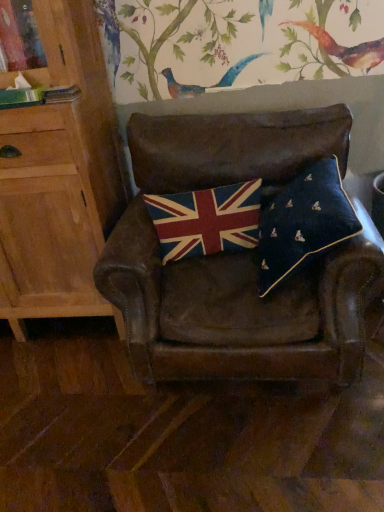
Describe the element at coordinates (237, 258) in the screenshot. The width and height of the screenshot is (384, 512). I see `leather chair at center` at that location.

This screenshot has width=384, height=512. What do you see at coordinates (206, 220) in the screenshot?
I see `textured woolen flag at center` at bounding box center [206, 220].

The width and height of the screenshot is (384, 512). What are the coordinates of `leather chair at center` in the screenshot? It's located at point(237,258).

Is point (252, 266) closer to camera compared to point (334, 217)?

No.

From a real-world perspective, between leather chair at center and navy velvet pillow at center, who is vertically higher?

navy velvet pillow at center, from a real-world perspective.

From the image's perspective, between leather chair at center and navy velvet pillow at center, which one is located above?

leather chair at center, from the image's perspective.

Identify the location of chair that appears on the left of navy velvet pillow at center. (237, 258).

Between navy velvet pillow at center and leather chair at center, which one has larger width?

Wider between the two is leather chair at center.

Does navy velvet pillow at center lie behind leather chair at center?

Yes, navy velvet pillow at center is behind leather chair at center.

From a real-world perspective, is navy velvet pillow at center physically located above or below leather chair at center?

navy velvet pillow at center is above leather chair at center.

The image size is (384, 512). I want to click on chair lying above the navy velvet pillow at center (from the image's perspective), so coord(237,258).

Can you confirm if textured woolen flag at center is positioned to the left of leather chair at center?

Correct, you'll find textured woolen flag at center to the left of leather chair at center.

Considering the positions of point (162, 226) and point (281, 300), is point (162, 226) closer or farther from the camera than point (281, 300)?

Point (162, 226) is farther from the camera than point (281, 300).

From the image's perspective, relative to leather chair at center, is textured woolen flag at center above or below?

textured woolen flag at center is above leather chair at center.

Choose the correct answer: Is textured woolen flag at center inside leather chair at center or outside it?

The correct answer is: inside.

From their relative heights in the image, would you say light wood cabinet at left is taller or shorter than textured woolen flag at center?

Considering their sizes, light wood cabinet at left has more height than textured woolen flag at center.

Is light wood cabinet at left closer to the viewer compared to textured woolen flag at center?

Yes, light wood cabinet at left is closer to the viewer.

Between light wood cabinet at left and textured woolen flag at center, which one appears on the right side from the viewer's perspective?

Positioned to the right is textured woolen flag at center.

How distant is light wood cabinet at left from textured woolen flag at center?

17.85 inches.

Identify the location of cabinetry to the left of leather chair at center. (60, 178).

From a real-world perspective, which is physically above, light wood cabinet at left or leather chair at center?

light wood cabinet at left is physically above.

Consider the image. Is leather chair at center completely or partially inside light wood cabinet at left?

That's incorrect, leather chair at center is not inside light wood cabinet at left.

From the image's perspective, is light wood cabinet at left positioned above or below leather chair at center?

light wood cabinet at left is situated higher than leather chair at center in the image.

From a real-world perspective, between light wood cabinet at left and navy velvet pillow at center, who is vertically lower?

navy velvet pillow at center is physically lower.

Is light wood cabinet at left directly adjacent to navy velvet pillow at center?

They are not placed beside each other.

Measure the distance from light wood cabinet at left to navy velvet pillow at center.

light wood cabinet at left is 31.27 inches away from navy velvet pillow at center.

Considering the relative sizes of light wood cabinet at left and navy velvet pillow at center in the image provided, is light wood cabinet at left smaller than navy velvet pillow at center?

No, light wood cabinet at left is not smaller than navy velvet pillow at center.

Measure the distance from leather chair at center to light wood cabinet at left.

A distance of 45.12 centimeters exists between leather chair at center and light wood cabinet at left.

Is leather chair at center behind light wood cabinet at left?

No, the depth of leather chair at center is less than that of light wood cabinet at left.

Does leather chair at center have a larger size compared to light wood cabinet at left?

Correct, leather chair at center is larger in size than light wood cabinet at left.

Locate an element on the screen. This screenshot has height=512, width=384. chair below the light wood cabinet at left (from the image's perspective) is located at coordinates (237, 258).

The width and height of the screenshot is (384, 512). Identify the location of chair located above the navy velvet pillow at center (from the image's perspective). (237, 258).

Locate an element on the screen. The image size is (384, 512). chair below the navy velvet pillow at center (from a real-world perspective) is located at coordinates (237, 258).

When comparing their distances from navy velvet pillow at center, does textured woolen flag at center or light wood cabinet at left seem closer?

Among the two, textured woolen flag at center is located nearer to navy velvet pillow at center.

In the scene shown: Estimate the real-world distances between objects in this image. Which object is closer to leather chair at center, navy velvet pillow at center or textured woolen flag at center?

textured woolen flag at center is positioned closer to the anchor leather chair at center.

Based on the photo, when comparing their distances from light wood cabinet at left, does textured woolen flag at center or leather chair at center seem further?

textured woolen flag at center lies further to light wood cabinet at left than the other object.

Based on their spatial positions, is textured woolen flag at center or light wood cabinet at left further from leather chair at center?

light wood cabinet at left lies further to leather chair at center than the other object.

Based on their spatial positions, is textured woolen flag at center or navy velvet pillow at center further from light wood cabinet at left?

navy velvet pillow at center is positioned further to the anchor light wood cabinet at left.

Looking at the image, which one is located closer to textured woolen flag at center, navy velvet pillow at center or leather chair at center?

Based on the image, leather chair at center appears to be nearer to textured woolen flag at center.

Based on their spatial positions, is light wood cabinet at left or leather chair at center further from navy velvet pillow at center?

light wood cabinet at left.

Estimate the real-world distances between objects in this image. Which object is closer to textured woolen flag at center, light wood cabinet at left or navy velvet pillow at center?

Based on the image, navy velvet pillow at center appears to be nearer to textured woolen flag at center.

Identify the location of chair located between light wood cabinet at left and navy velvet pillow at center in the left-right direction. The height and width of the screenshot is (512, 384). (237, 258).

In order to click on flag between light wood cabinet at left and leather chair at center in this screenshot , I will do `click(206, 220)`.

Locate an element on the screen. The width and height of the screenshot is (384, 512). flag located between light wood cabinet at left and navy velvet pillow at center in the left-right direction is located at coordinates (206, 220).

Find the location of a particular element. pillow located between leather chair at center and textured woolen flag at center in the depth direction is located at coordinates (304, 222).